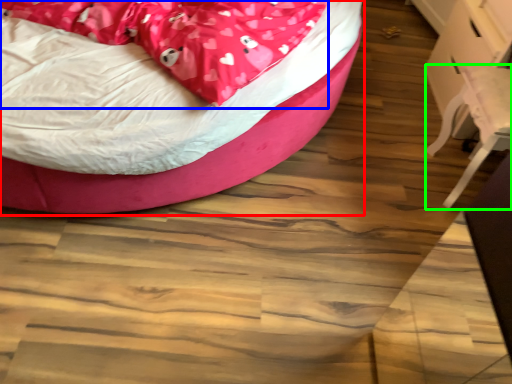
Question: Estimate the real-world distances between objects in this image. Which object is farther from bed (highlighted by a red box), blanket (highlighted by a blue box) or swivel chair (highlighted by a green box)?

Choices:
 (A) blanket
 (B) swivel chair

Answer: (B)